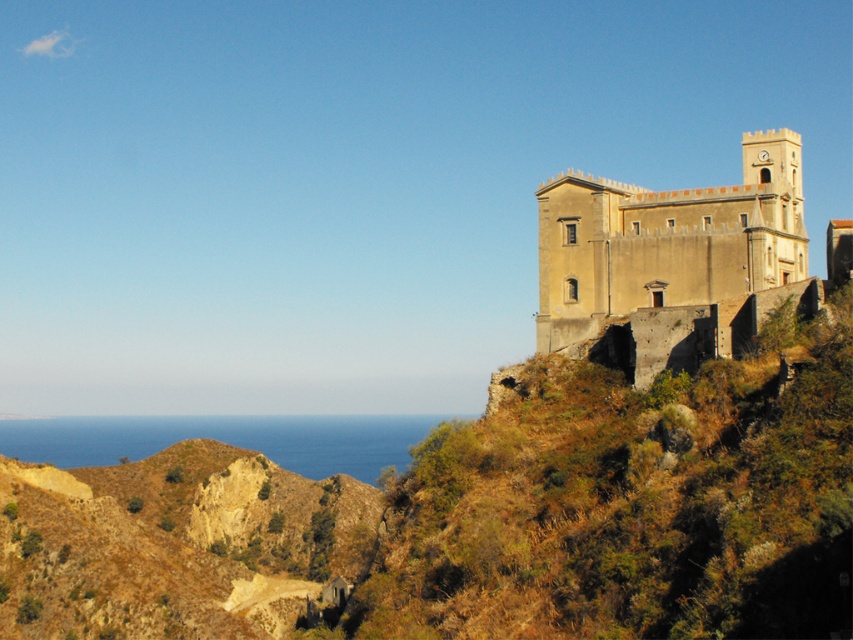
You are standing at the base of the historic stone building and want to reach the brown rocky hill at lower left marked by point (173, 545). What direction should you walk to reach it?

The brown rocky hill at lower left is located at point (173, 545), so you should walk towards the lower left direction to reach it.

You are a hiker who wants to take a photo of the beige stone fort at upper right. You are currently standing on the brown rocky hill at lower left. Which direction should you move to get a better view of the fort?

You should move to the right side of the brown rocky hill at lower left to get a better view of the beige stone fort at upper right, as the hill is wider than the fort.

You are a hiker standing at the base of the brown rocky hill at lower left. You want to reach the historic stone building on the hilltop. Which direction should you head to from your current position?

The historic stone building is located on the hilltop, so you should head upwards from the brown rocky hill at lower left to reach it.